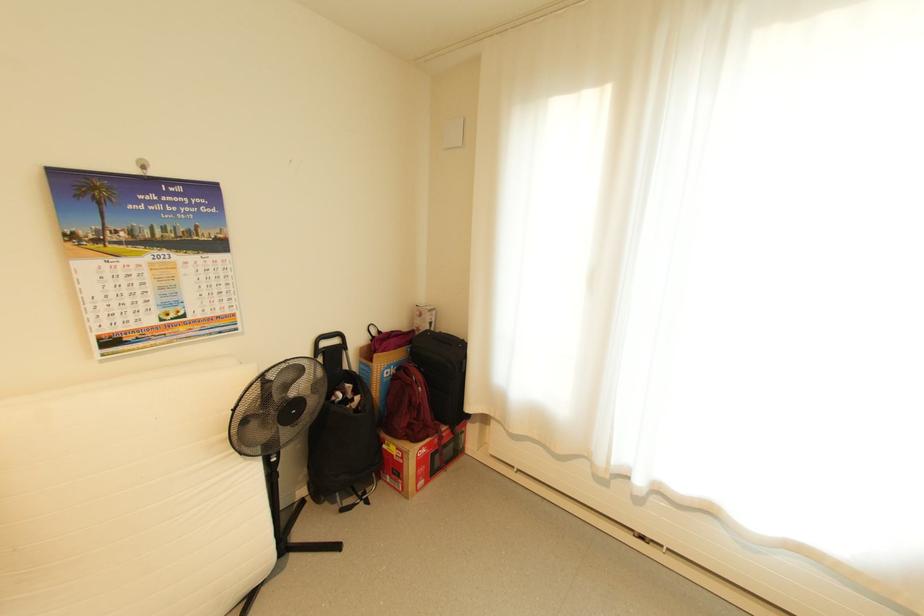
Locate an element on the screen. The height and width of the screenshot is (616, 924). red backpack handle is located at coordinates (399, 365).